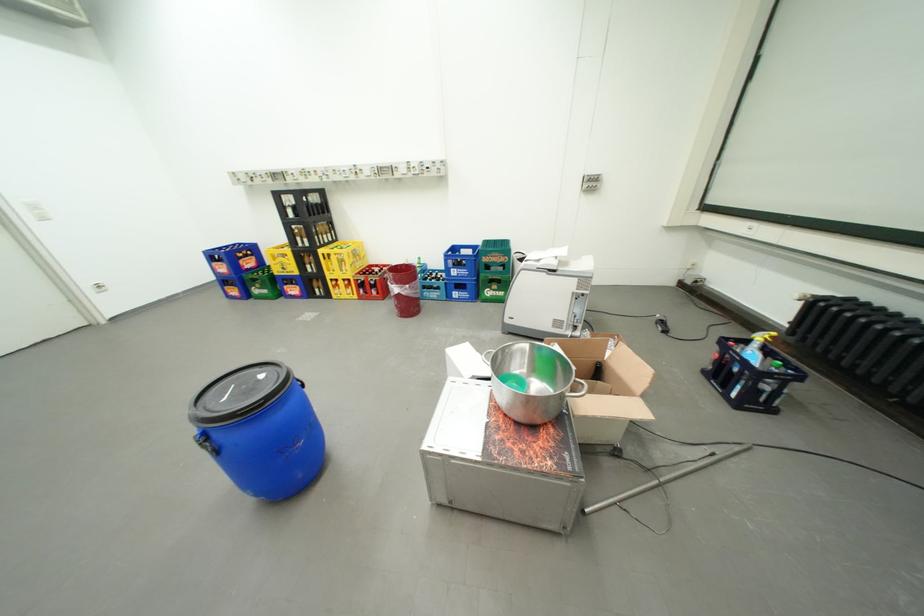
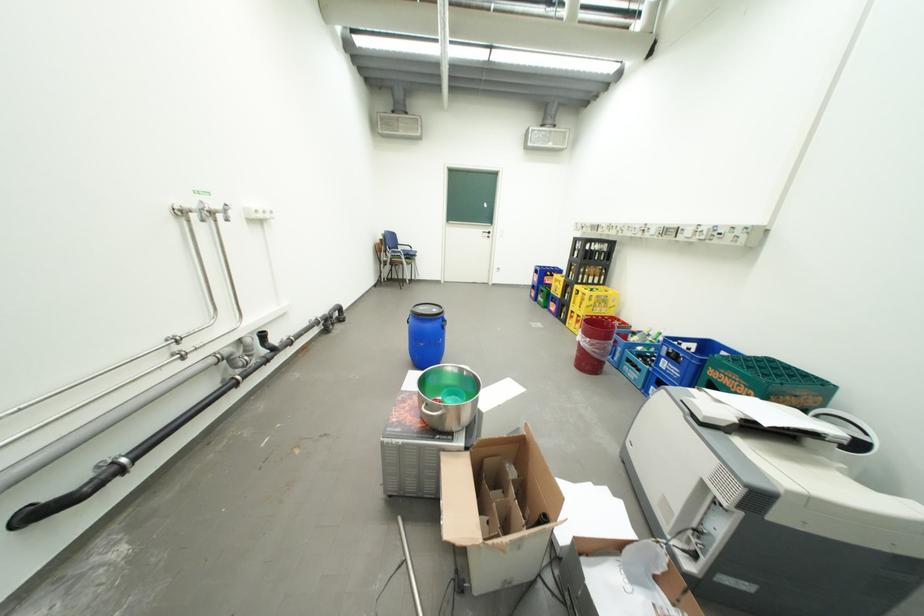
The point at (356,275) is marked in the first image. Where is the corresponding point in the second image?

(590, 312)